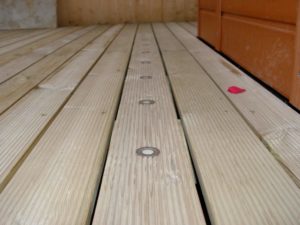
Where is `light beige floorboard`? The height and width of the screenshot is (225, 300). light beige floorboard is located at coordinates (147, 128).